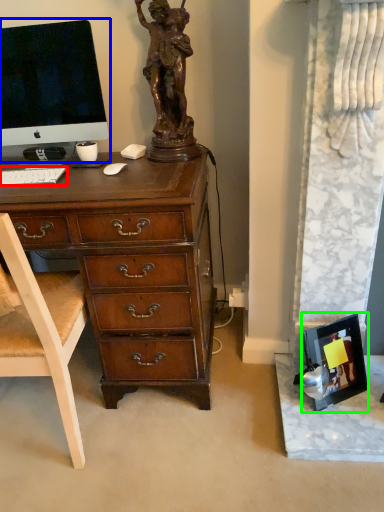
Question: Estimate the real-world distances between objects in this image. Which object is farther from computer keyboard (highlighted by a red box), computer monitor (highlighted by a blue box) or picture frame (highlighted by a green box)?

Choices:
 (A) computer monitor
 (B) picture frame

Answer: (B)